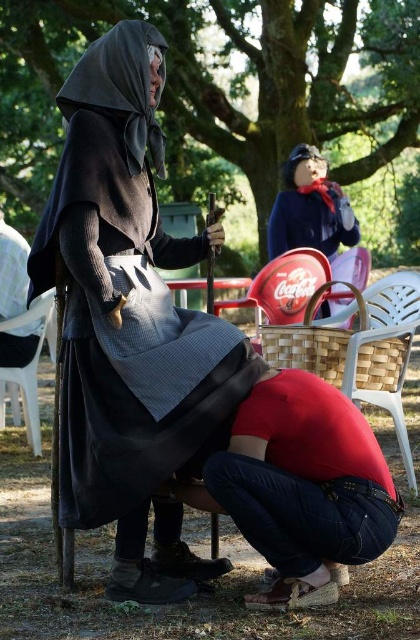
Who is more distant from viewer, (315, 160) or (36, 403)?

Point (315, 160)

Identify the location of matte blue dress at upper center. Image resolution: width=420 pixels, height=640 pixels. (309, 208).

Does woven wood chair at center have a greater height compared to white plastic chair at lower left?

Yes, woven wood chair at center is taller than white plastic chair at lower left.

Who is positioned more to the right, woven wood chair at center or white plastic chair at lower left?

woven wood chair at center

Which is in front, point (354, 401) or point (36, 369)?

Positioned in front is point (354, 401).

This screenshot has width=420, height=640. Identify the location of woven wood chair at center. (357, 348).

Identify the location of woven wood chair at center. Image resolution: width=420 pixels, height=640 pixels. (357, 348).

Is woven wood chair at center closer to camera compared to matte blue dress at upper center?

Yes, woven wood chair at center is closer to the viewer.

I want to click on woven wood chair at center, so click(357, 348).